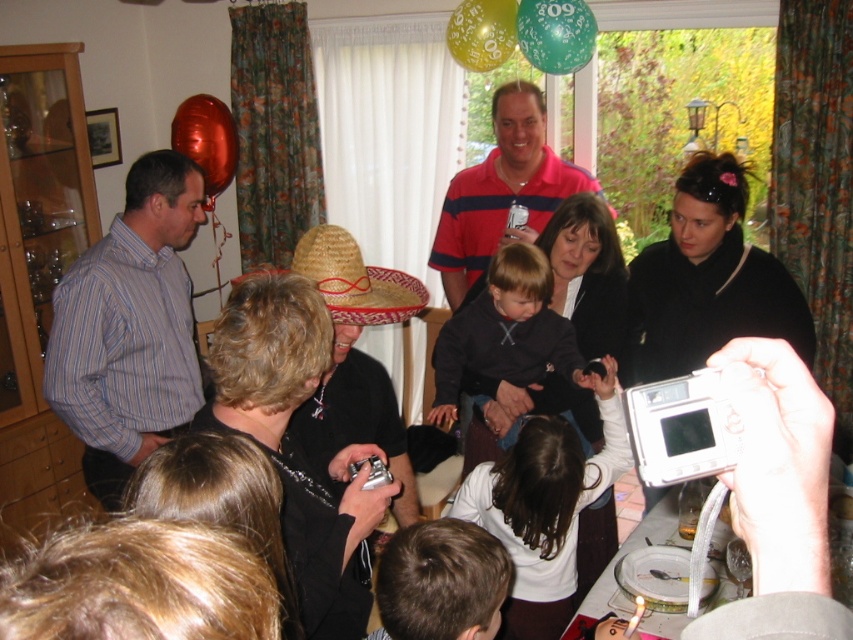
The width and height of the screenshot is (853, 640). What do you see at coordinates (129, 326) in the screenshot?
I see `striped cotton shirt at left` at bounding box center [129, 326].

Is striped cotton shirt at left shorter than dark blue sweater at center?

In fact, striped cotton shirt at left may be taller than dark blue sweater at center.

Locate an element on the screen. striped cotton shirt at left is located at coordinates (129, 326).

Does point (531, 621) lie in front of point (554, 177)?

Yes, point (531, 621) is closer to viewer.

Between point (535, 518) and point (486, 221), which one is positioned in front?

Point (535, 518) is in front.

Is point (611, 465) closer to viewer compared to point (454, 212)?

Yes, point (611, 465) is in front of point (454, 212).

The image size is (853, 640). What are the coordinates of `white cotton shirt at center` in the screenshot? It's located at (544, 508).

Is point (131, 301) positioned in front of point (515, 614)?

No.

Which of these two, striped cotton shirt at left or white cotton shirt at center, stands shorter?

Standing shorter between the two is white cotton shirt at center.

Between point (183, 392) and point (614, 435), which one is positioned in front?

Point (614, 435) is more forward.

Locate an element on the screen. This screenshot has height=640, width=853. striped cotton shirt at left is located at coordinates (129, 326).